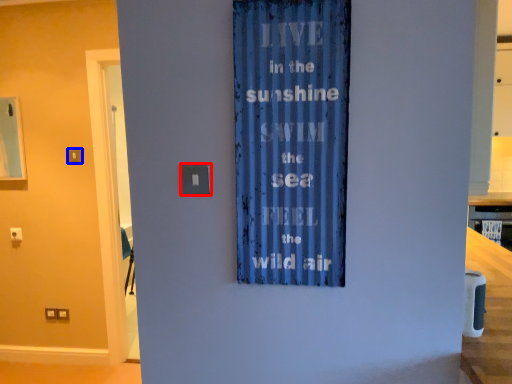
Question: Which of the following is the closest to the observer, light switch (highlighted by a red box) or light switch (highlighted by a blue box)?

Choices:
 (A) light switch
 (B) light switch

Answer: (A)